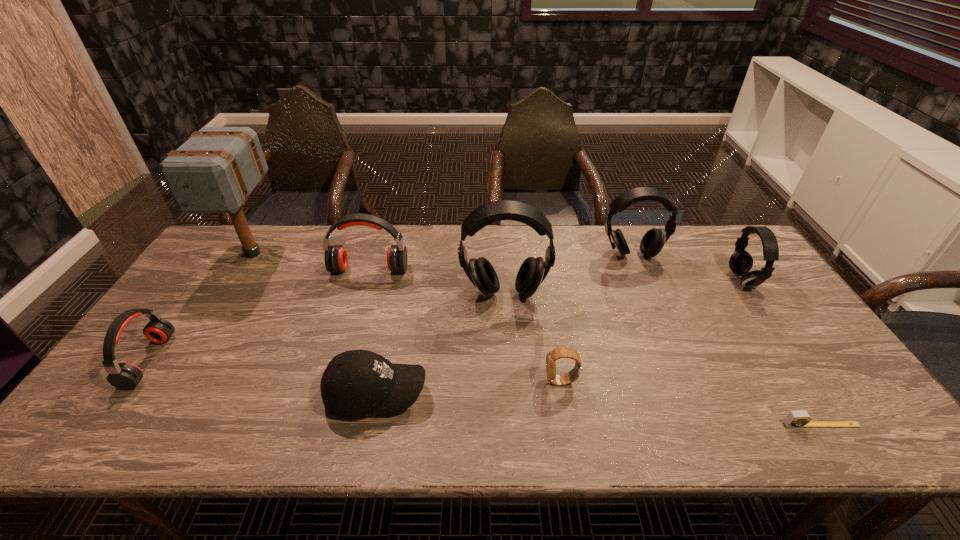
The image size is (960, 540). I want to click on the nearer red earphone, so click(126, 376).

Locate an element on the screen. the nearest earphone is located at coordinates point(126,376).

The image size is (960, 540). In order to click on baseball cap in this screenshot , I will do `click(355, 383)`.

Locate an element on the screen. The height and width of the screenshot is (540, 960). watch is located at coordinates (560, 352).

Where is `the shortest object`? the shortest object is located at coordinates (795, 419).

The height and width of the screenshot is (540, 960). Identify the location of free space located 0.400m on the striking surface of the mallet. (168, 389).

Image resolution: width=960 pixels, height=540 pixels. In order to click on free location located on the ear cups of the tallest earphone in this screenshot , I will do `click(509, 363)`.

The height and width of the screenshot is (540, 960). Identify the location of free space located on the ear cups of the seventh shortest object. (640, 276).

This screenshot has width=960, height=540. In order to click on free space located on the ear cups of the right red earphone in this screenshot , I will do `click(360, 303)`.

This screenshot has width=960, height=540. In order to click on blank space located on the ear cups of the rightmost earphone in this screenshot , I will do (627, 280).